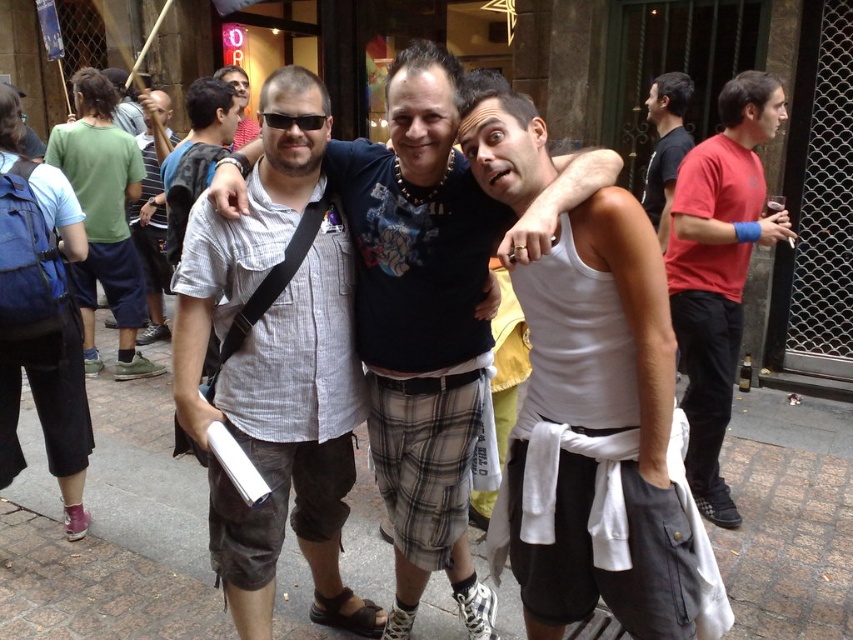
Measure the distance between point (494, 547) and camera.

Point (494, 547) is 6.62 feet from camera.

How distant is white matte tank top at center from blue backpack at left?

white matte tank top at center is 6.00 feet from blue backpack at left.

Does point (648, 444) come in front of point (3, 465)?

Yes, point (648, 444) is in front of point (3, 465).

Where is `white matte tank top at center`? The width and height of the screenshot is (853, 640). white matte tank top at center is located at coordinates (602, 442).

Is point (512, 141) behind point (299, 124)?

That is False.

Does white matte tank top at center have a greater height compared to black plastic sunglasses at center?

Indeed, white matte tank top at center has a greater height compared to black plastic sunglasses at center.

Consider the image. Who is more forward, (544, 637) or (312, 128)?

Positioned in front is point (312, 128).

Where is `white matte tank top at center`? white matte tank top at center is located at coordinates (602, 442).

Is point (556, 595) less distant than point (683, 108)?

Yes.

Is white matte tank top at center positioned behind black cotton shirt at upper right?

No, white matte tank top at center is in front of black cotton shirt at upper right.

The image size is (853, 640). I want to click on white matte tank top at center, so click(602, 442).

This screenshot has width=853, height=640. I want to click on white matte tank top at center, so [x=602, y=442].